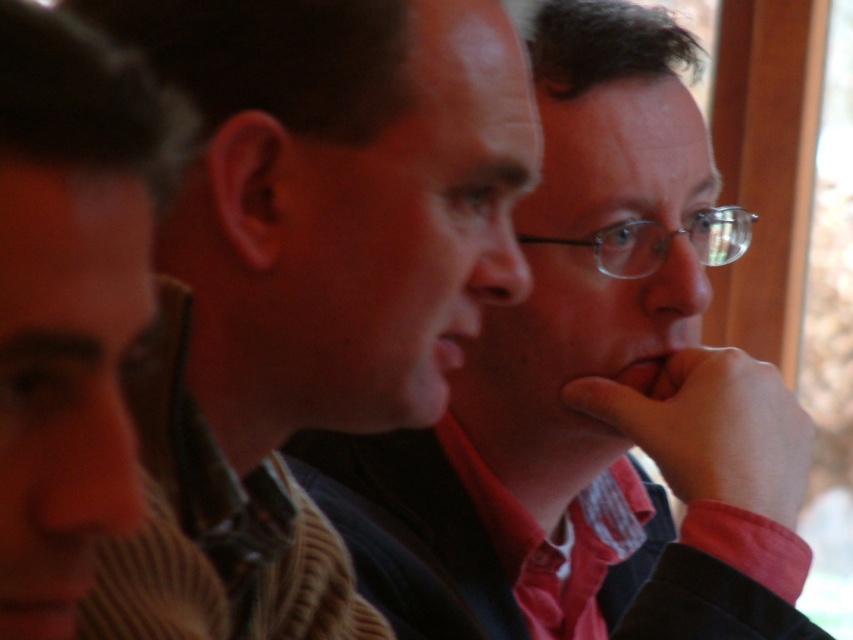
Question: Among these objects, which one is nearest to the camera?

Choices:
 (A) matte skin nose at center
 (B) matte black jacket at center
 (C) matte glass nose at center
 (D) matte black shirt at center

Answer: (D)

Question: Is matte glass nose at center thinner than matte skin nose at center?

Choices:
 (A) yes
 (B) no

Answer: (B)

Question: Which of the following is the closest to the observer?

Choices:
 (A) brown striped sweater at left
 (B) matte black shirt at center
 (C) matte glass nose at center
 (D) matte black jacket at center

Answer: (A)

Question: Among these objects, which one is farthest from the camera?

Choices:
 (A) brown striped sweater at left
 (B) matte black jacket at center

Answer: (B)

Question: Where is brown striped sweater at left located in relation to matte glass nose at center in the image?

Choices:
 (A) right
 (B) left

Answer: (B)

Question: Is brown striped sweater at left smaller than matte skin nose at center?

Choices:
 (A) no
 (B) yes

Answer: (A)